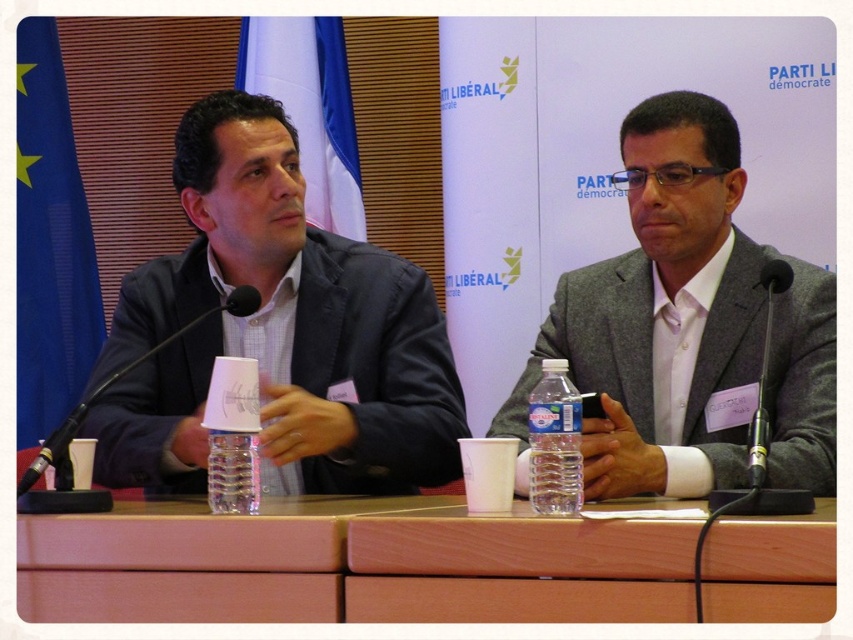
Is matte blue suit at center behind gray wool suit at center?

Yes, matte blue suit at center is further from the viewer.

In the scene shown: Who is shorter, matte blue suit at center or gray wool suit at center?

With less height is gray wool suit at center.

Which is in front, point (347, 440) or point (712, 300)?

Point (347, 440)

Where is `matte blue suit at center`? matte blue suit at center is located at coordinates (276, 332).

Who is taller, matte blue suit at center or clear plastic water bottle at center?

matte blue suit at center is taller.

Who is shorter, matte blue suit at center or clear plastic water bottle at center?

With less height is clear plastic water bottle at center.

Find the location of a particular element. matte blue suit at center is located at coordinates (276, 332).

What do you see at coordinates (276, 332) in the screenshot?
I see `matte blue suit at center` at bounding box center [276, 332].

Between point (175, 291) and point (16, 550), which one is positioned behind?

Positioned behind is point (175, 291).

This screenshot has width=853, height=640. What are the coordinates of `matte blue suit at center` in the screenshot? It's located at (276, 332).